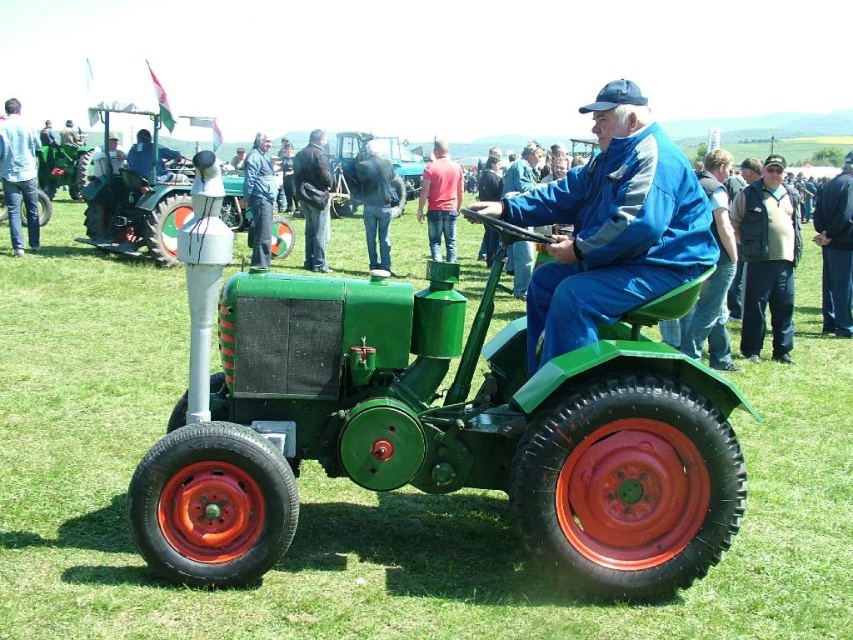
Is dark gray fabric jacket at center thinner than green matte tractor at left?

Correct, dark gray fabric jacket at center's width is less than green matte tractor at left's.

What do you see at coordinates (312, 198) in the screenshot? The width and height of the screenshot is (853, 640). I see `dark gray fabric jacket at center` at bounding box center [312, 198].

Does point (312, 145) come behind point (65, 148)?

No, it is not.

Identify the location of dark gray fabric jacket at center. (312, 198).

Does point (361, 189) lie behind point (44, 182)?

No, it is in front of (44, 182).

Does denim jacket at center have a lesser width compared to green matte tractor at left?

Yes, denim jacket at center is thinner than green matte tractor at left.

Is point (375, 141) more distant than point (51, 180)?

No, it is not.

The height and width of the screenshot is (640, 853). I want to click on denim jacket at center, so click(x=375, y=204).

Identify the location of blue denim jacket at center. The height and width of the screenshot is (640, 853). (259, 198).

Does blue denim jacket at center have a greater height compared to green matte tractor at left?

No.

Where is `blue denim jacket at center`? blue denim jacket at center is located at coordinates (259, 198).

The height and width of the screenshot is (640, 853). What are the coordinates of `blue denim jacket at center` in the screenshot? It's located at (259, 198).